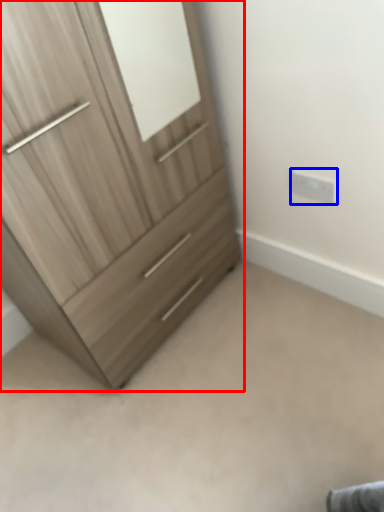
Question: Which point is closer to the camera, chest of drawers (highlighted by a red box) or electric outlet (highlighted by a blue box)?

Choices:
 (A) chest of drawers
 (B) electric outlet

Answer: (A)